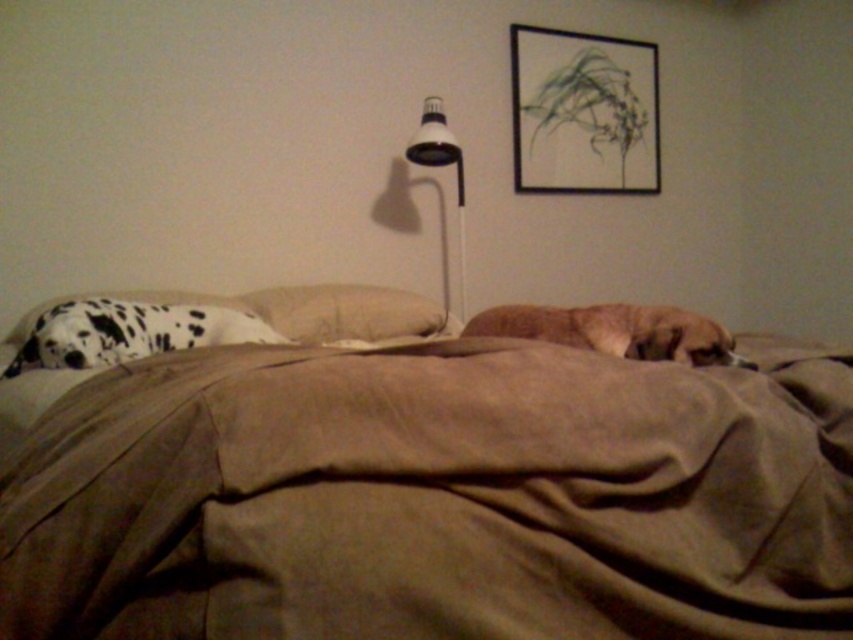
Question: Which of these objects is positioned farthest from the white plastic lamp at upper center?

Choices:
 (A) matte black picture frame at upper right
 (B) brown cotton bed at center

Answer: (B)

Question: Does brown cotton bed at center have a greater width compared to beige cotton pillow at center?

Choices:
 (A) no
 (B) yes

Answer: (B)

Question: From the image, what is the correct spatial relationship of brown fur dog at center in relation to beige cotton pillow at center?

Choices:
 (A) left
 (B) right

Answer: (B)

Question: Which point is closer to the camera?

Choices:
 (A) (459, 221)
 (B) (628, 353)
 (C) (387, 291)
 (D) (572, 550)

Answer: (D)

Question: Can you confirm if brown cotton bed at center is wider than white plastic lamp at upper center?

Choices:
 (A) no
 (B) yes

Answer: (B)

Question: Which point is closer to the camera?

Choices:
 (A) (459, 234)
 (B) (503, 314)

Answer: (B)